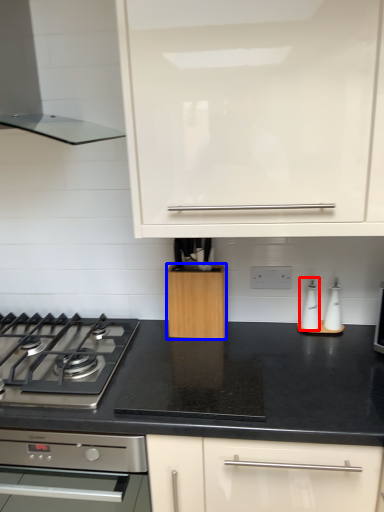
Question: Among these objects, which one is nearest to the camera, appliance (highlighted by a red box) or kitchen appliance (highlighted by a blue box)?

Choices:
 (A) appliance
 (B) kitchen appliance

Answer: (B)